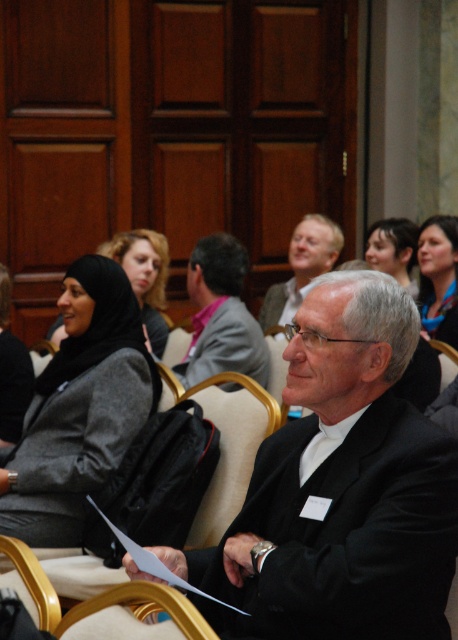
Question: Is black matte suit at center positioned behind smooth brown hair at upper right?

Choices:
 (A) yes
 (B) no

Answer: (B)

Question: Among these objects, which one is farthest from the camera?

Choices:
 (A) matte black hijab at upper left
 (B) gray fabric jacket at center

Answer: (B)

Question: Is black matte suit at center smaller than gray fabric jacket at center?

Choices:
 (A) no
 (B) yes

Answer: (A)

Question: Which point is farther to the camera?

Choices:
 (A) (81, 332)
 (B) (421, 298)

Answer: (B)

Question: Estimate the real-world distances between objects in this image. Which object is closer to the black matte suit at center?

Choices:
 (A) matte black hijab at lower left
 (B) gray fabric jacket at center
 (C) matte black hair at upper right

Answer: (B)

Question: Is dark gray woolen jacket at left below gray fabric jacket at center?

Choices:
 (A) no
 (B) yes

Answer: (B)